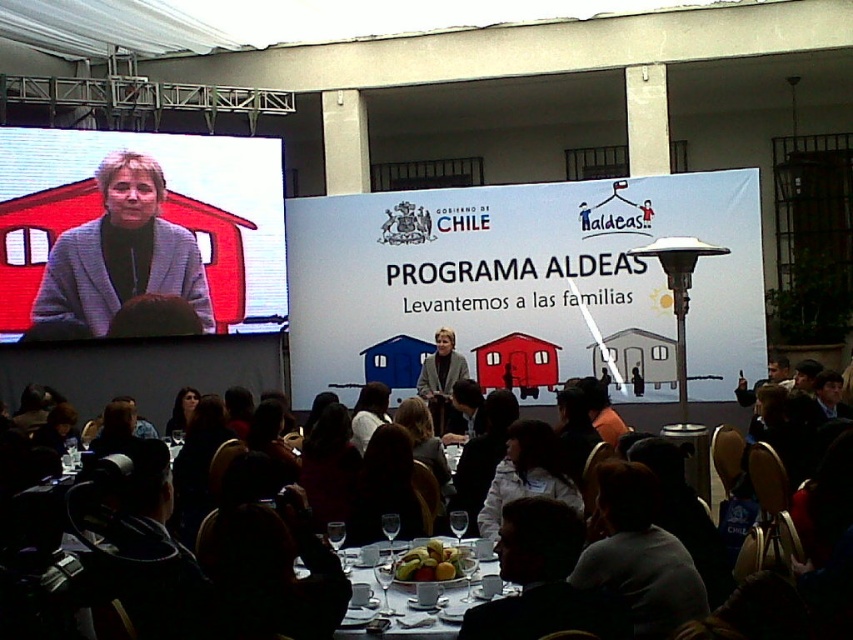
Question: Estimate the real-world distances between objects in this image. Which object is farther from the white paperboard at center?

Choices:
 (A) matte black chairs at center
 (B) matte gray blazer at upper left
 (C) smooth yellow fruit at center

Answer: (C)

Question: Which point is farther from the camera taking this photo?

Choices:
 (A) (148, 192)
 (B) (489, 344)

Answer: (B)

Question: Is matte gray blazer at upper left closer to camera compared to smooth yellow fruit at center?

Choices:
 (A) no
 (B) yes

Answer: (A)

Question: Which is nearer to the white glossy table at center?

Choices:
 (A) matte gray coat at center
 (B) white paperboard at center

Answer: (A)

Question: Does matte gray coat at center lie behind smooth yellow fruit at center?

Choices:
 (A) no
 (B) yes

Answer: (B)

Question: Is white paperboard at center thinner than matte black chairs at center?

Choices:
 (A) yes
 (B) no

Answer: (A)